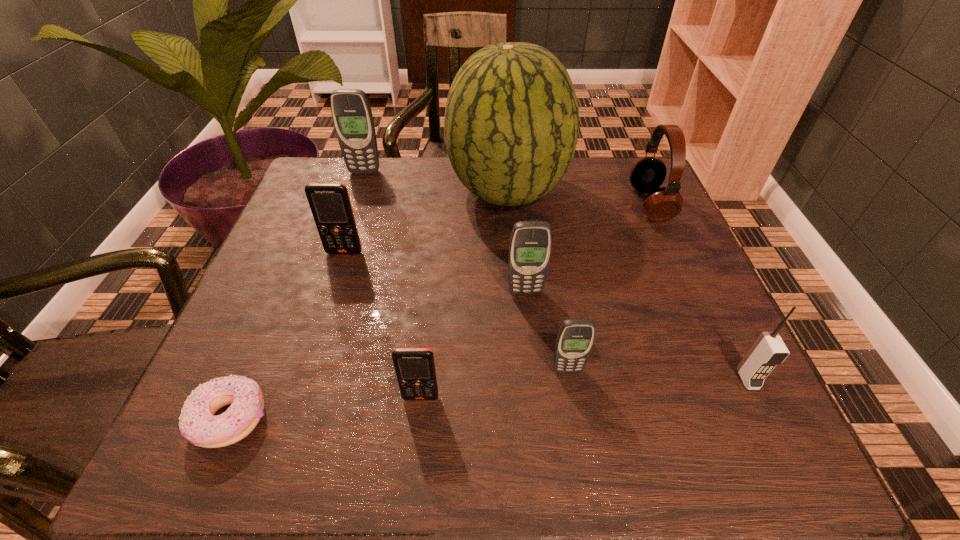
Identify the location of vacant area that lies between the shortest object and the headset. (441, 312).

Locate which object is the eighth closest to the smallest gray cellular telephone. Please provide its 2D coordinates. Your answer should be formatted as a tuple, i.e. [(x, y)], where the tuple contains the x and y coordinates of a point satisfying the conditions above.

[(351, 112)]

Locate which object ranks sixth in proximity to the watermelon. Please provide its 2D coordinates. Your answer should be formatted as a tuple, i.e. [(x, y)], where the tuple contains the x and y coordinates of a point satisfying the conditions above.

[(415, 369)]

Where is `cellular telephone that is the second closest to the smallest gray cellular telephone`? This screenshot has height=540, width=960. cellular telephone that is the second closest to the smallest gray cellular telephone is located at coordinates (415, 369).

Select which cellular telephone appears as the closest to the right orange cellular telephone. Please provide its 2D coordinates. Your answer should be formatted as a tuple, i.e. [(x, y)], where the tuple contains the x and y coordinates of a point satisfying the conditions above.

[(575, 338)]

This screenshot has height=540, width=960. Identify the location of gray cellular telephone that stands as the second closest to the fourth cellular telephone from right to left. (530, 246).

Locate which gray cellular telephone ranks in proximity to the fifth farthest object. Please provide its 2D coordinates. Your answer should be formatted as a tuple, i.e. [(x, y)], where the tuple contains the x and y coordinates of a point satisfying the conditions above.

[(575, 338)]

The image size is (960, 540). Identify the location of free space that satisfies the following two spatial constraints: 1. on the ear pads of the black headset; 2. on the screen of the nearest gray cellular telephone. [x=723, y=370].

The height and width of the screenshot is (540, 960). Find the location of `vacant space that satisfies the following two spatial constraints: 1. on the ear pads of the black headset; 2. on the screen of the second smallest gray cellular telephone`. vacant space that satisfies the following two spatial constraints: 1. on the ear pads of the black headset; 2. on the screen of the second smallest gray cellular telephone is located at coordinates point(689,293).